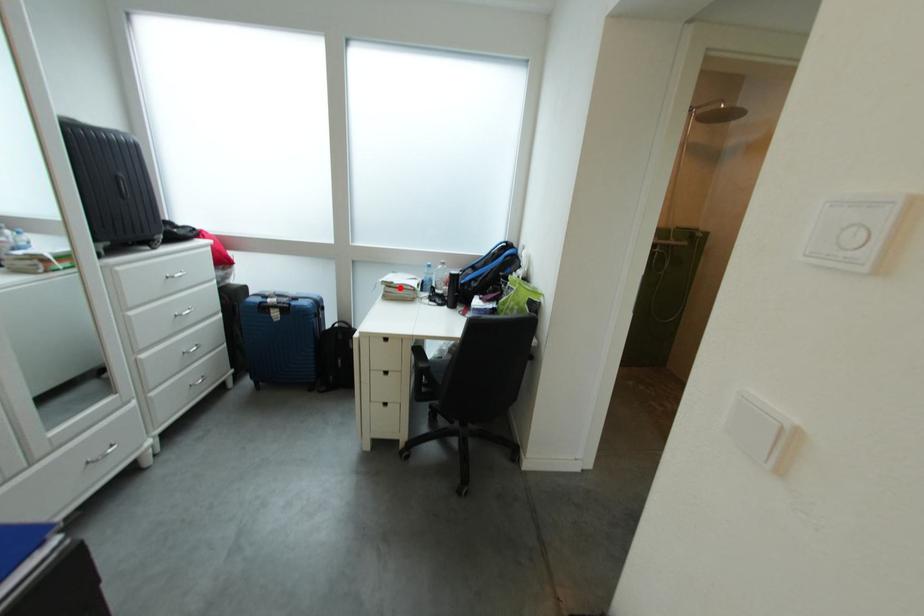
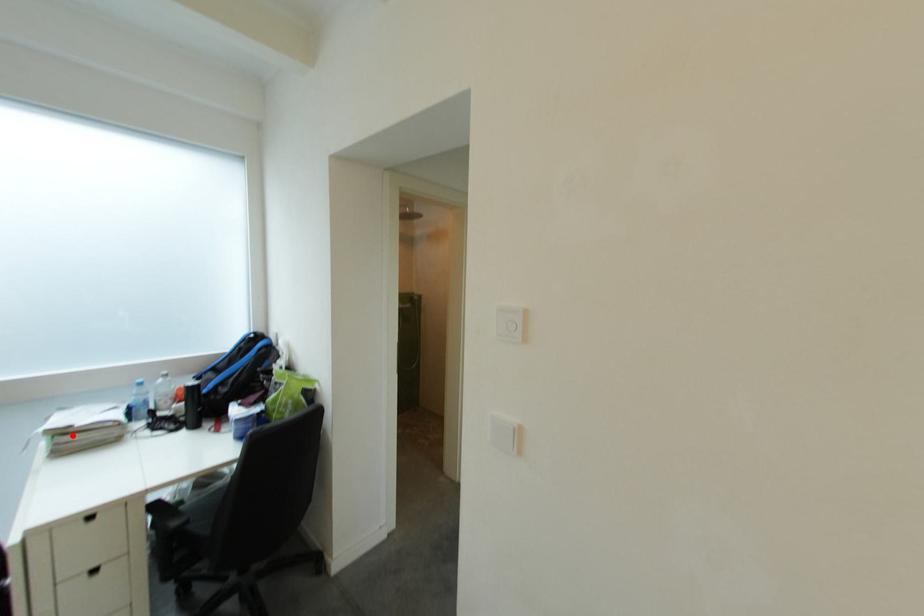
I am providing you with two images of the same scene from different viewpoints. A red point is marked on the first image and another point is marked on the second image. Does the point marked in image1 correspond to the same location as the one in image2?

Yes